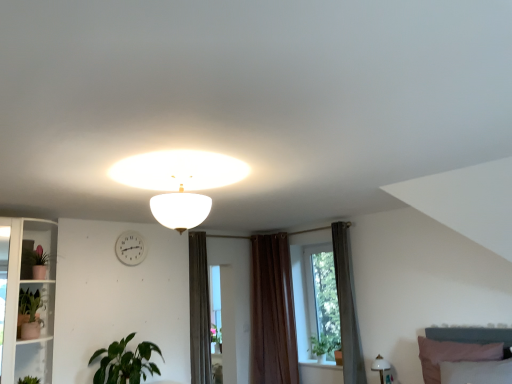
Question: Does brown fabric curtain at center, which is the 1th curtain from right to left, have a greater height compared to white glass shelf at left?

Choices:
 (A) yes
 (B) no

Answer: (A)

Question: Is brown fabric curtain at center, which is the 1th curtain from right to left, smaller than white glass shelf at left?

Choices:
 (A) no
 (B) yes

Answer: (B)

Question: From a real-world perspective, is brown fabric curtain at center, which is the second curtain from back to front, located higher than white glass shelf at left?

Choices:
 (A) no
 (B) yes

Answer: (A)

Question: Is brown fabric curtain at center, which is the second curtain in left-to-right order, bigger than white glass shelf at left?

Choices:
 (A) no
 (B) yes

Answer: (A)

Question: From the image's perspective, does brown fabric curtain at center, which is the 1th curtain from right to left, appear higher than white glass shelf at left?

Choices:
 (A) no
 (B) yes

Answer: (A)

Question: From the image's perspective, relative to white glossy lamp at lower right, the first lamp from the right, is white glass shelf at left above or below?

Choices:
 (A) below
 (B) above

Answer: (B)

Question: Is point (23, 231) positioned closer to the camera than point (379, 355)?

Choices:
 (A) closer
 (B) farther

Answer: (A)

Question: In terms of size, does white glass shelf at left appear bigger or smaller than white glossy lamp at lower right, arranged as the second lamp when viewed from the top?

Choices:
 (A) small
 (B) big

Answer: (B)

Question: Is white glass shelf at left to the left or to the right of white glossy lamp at lower right, which appears as the first lamp when ordered from the bottom, in the image?

Choices:
 (A) left
 (B) right

Answer: (A)

Question: From a real-world perspective, is matte pink pot at left, the 1th plant positioned from the top, positioned above or below green matte plant at left, which is counted as the second houseplant, starting from the bottom?

Choices:
 (A) below
 (B) above

Answer: (B)

Question: Considering the positions of matte pink pot at left, marked as the second plant in a bottom-to-top arrangement, and green matte plant at left, which ranks as the 2th houseplant in right-to-left order, in the image, is matte pink pot at left, marked as the second plant in a bottom-to-top arrangement, bigger or smaller than green matte plant at left, which ranks as the 2th houseplant in right-to-left order,?

Choices:
 (A) small
 (B) big

Answer: (A)

Question: From the image's perspective, relative to green matte plant at left, the first houseplant viewed from the left, is matte pink pot at left, which is the 2th plant from right to left, above or below?

Choices:
 (A) above
 (B) below

Answer: (A)

Question: Is point 37,254 positioned closer to the camera than point 22,332?

Choices:
 (A) farther
 (B) closer

Answer: (A)

Question: In terms of height, does green leafy plant at window, which is the 2th plant in top-to-bottom order, look taller or shorter compared to brown velvet curtain at center, the 1th curtain when ordered from back to front?

Choices:
 (A) tall
 (B) short

Answer: (B)

Question: From a real-world perspective, relative to brown velvet curtain at center, the 1th curtain when ordered from back to front, is green leafy plant at window, which is counted as the 1th plant, starting from the bottom, vertically above or below?

Choices:
 (A) below
 (B) above

Answer: (A)